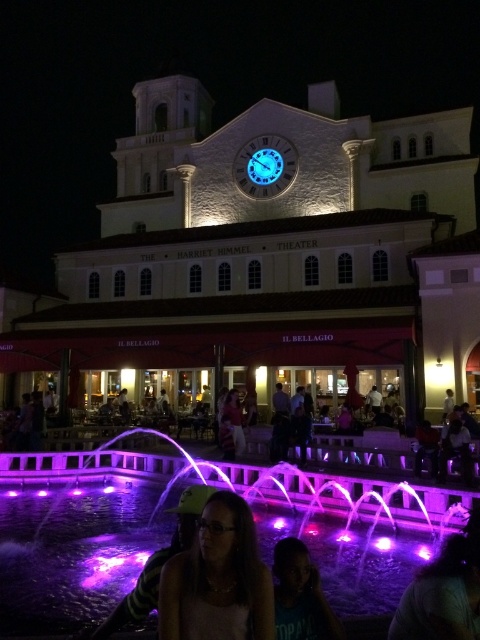
Question: Can you confirm if purple illuminated water at lower center is positioned below shiny purple hair at lower center?

Choices:
 (A) yes
 (B) no

Answer: (A)

Question: Estimate the real-world distances between objects in this image. Which object is farther from the smooth purple hair at lower right?

Choices:
 (A) matte black dress at center
 (B) matte black hair at lower center
 (C) purple illuminated water at lower center
 (D) matte black sunglasses at center

Answer: (A)

Question: Estimate the real-world distances between objects in this image. Which object is closer to the blue glass clock at center?

Choices:
 (A) matte black hair at lower center
 (B) purple illuminated water at lower center
 (C) matte black sunglasses at center

Answer: (B)

Question: Which object is the closest to the white stone building at center?

Choices:
 (A) matte black hair at lower center
 (B) blue glass clock at center
 (C) matte black dress at center

Answer: (B)

Question: Can you confirm if purple illuminated water at lower center is bigger than matte black dress at center?

Choices:
 (A) no
 (B) yes

Answer: (B)

Question: Can you confirm if matte black dress at center is positioned below shiny purple hair at lower center?

Choices:
 (A) no
 (B) yes

Answer: (A)